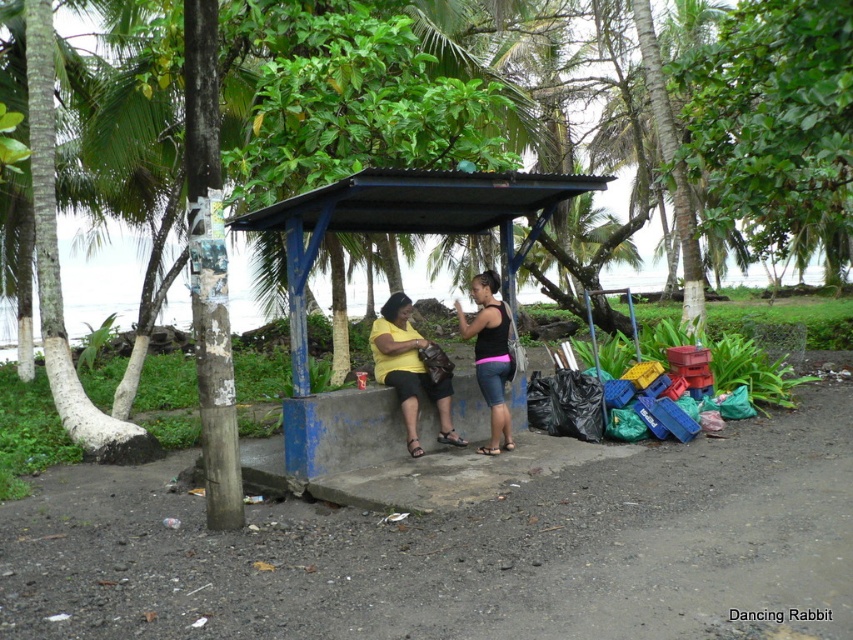
Question: Does white bark tree at center have a smaller size compared to yellow matte shirt at center?

Choices:
 (A) yes
 (B) no

Answer: (B)

Question: Can you confirm if white bark tree at center is wider than blue painted wood bus stop at center?

Choices:
 (A) no
 (B) yes

Answer: (B)

Question: Observing the image, what is the correct spatial positioning of blue painted wood bus stop at center in reference to pink fabric shorts at center?

Choices:
 (A) left
 (B) right

Answer: (A)

Question: Based on their relative distances, which object is nearer to the white bark tree at center?

Choices:
 (A) yellow matte shirt at center
 (B) blue painted wood bus stop at center

Answer: (B)

Question: Which object is closer to the camera taking this photo?

Choices:
 (A) blue painted wood bus stop at center
 (B) yellow matte shirt at center
 (C) white bark tree at center

Answer: (C)

Question: Which point appears closest to the camera in this image?

Choices:
 (A) (753, 147)
 (B) (398, 330)
 (C) (495, 216)
 (D) (500, 369)

Answer: (D)